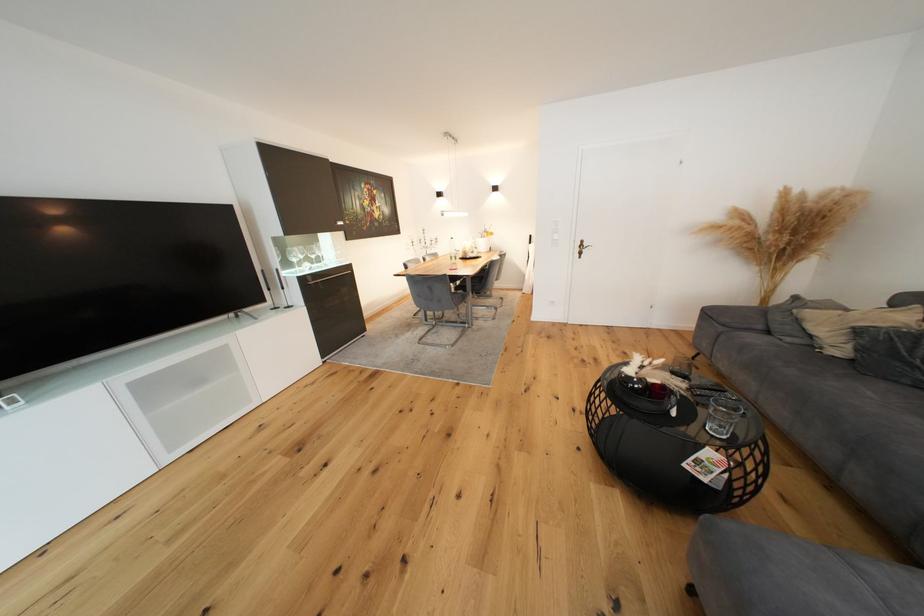
Find where to drink the dark drinking glass. Please return your answer as a coordinate pair (x, y).

(723, 416)